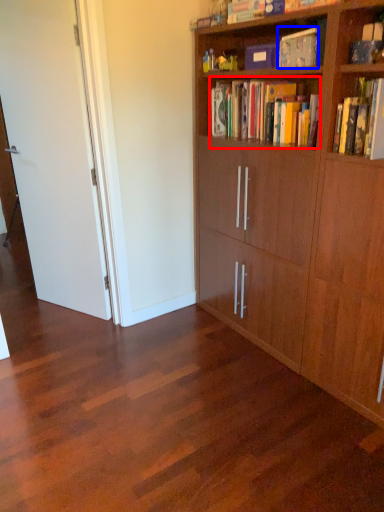
Question: Which object appears closest to the camera in this image, book (highlighted by a red box) or book (highlighted by a blue box)?

Choices:
 (A) book
 (B) book

Answer: (B)